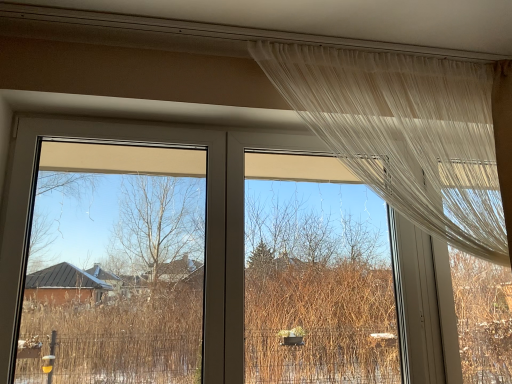
Question: From a real-world perspective, is transparent fabric at upper center, positioned as the 1th window screen in right-to-left order, positioned under sheer white curtain at upper right based on gravity?

Choices:
 (A) yes
 (B) no

Answer: (A)

Question: Are transparent fabric at upper center, placed as the second window screen when sorted from left to right, and sheer white curtain at upper right far apart?

Choices:
 (A) yes
 (B) no

Answer: (B)

Question: Is the surface of transparent fabric at upper center, positioned as the 1th window screen in right-to-left order, in direct contact with sheer white curtain at upper right?

Choices:
 (A) yes
 (B) no

Answer: (B)

Question: Does transparent fabric at upper center, placed as the second window screen when sorted from left to right, contain sheer white curtain at upper right?

Choices:
 (A) no
 (B) yes

Answer: (A)

Question: Is transparent fabric at upper center, placed as the second window screen when sorted from left to right, closer to camera compared to sheer white curtain at upper right?

Choices:
 (A) no
 (B) yes

Answer: (A)

Question: Considering the relative positions of transparent fabric at upper center, positioned as the 1th window screen in right-to-left order, and sheer white curtain at upper right in the image provided, is transparent fabric at upper center, positioned as the 1th window screen in right-to-left order, behind sheer white curtain at upper right?

Choices:
 (A) yes
 (B) no

Answer: (A)

Question: Considering the relative positions of transparent plastic window screen at left, the 2th window screen positioned from the right, and sheer white curtain at upper right in the image provided, is transparent plastic window screen at left, the 2th window screen positioned from the right, to the left of sheer white curtain at upper right from the viewer's perspective?

Choices:
 (A) no
 (B) yes

Answer: (B)

Question: Is transparent plastic window screen at left, which is the first window screen in left-to-right order, bigger than sheer white curtain at upper right?

Choices:
 (A) no
 (B) yes

Answer: (B)

Question: Considering the relative sizes of transparent plastic window screen at left, which is the first window screen in left-to-right order, and sheer white curtain at upper right in the image provided, is transparent plastic window screen at left, which is the first window screen in left-to-right order, smaller than sheer white curtain at upper right?

Choices:
 (A) yes
 (B) no

Answer: (B)

Question: Does transparent plastic window screen at left, which is the first window screen in left-to-right order, contain sheer white curtain at upper right?

Choices:
 (A) no
 (B) yes

Answer: (A)

Question: Is transparent plastic window screen at left, which is the first window screen in left-to-right order, positioned with its back to sheer white curtain at upper right?

Choices:
 (A) no
 (B) yes

Answer: (A)

Question: From the image's perspective, would you say transparent plastic window screen at left, the 2th window screen positioned from the right, is positioned over sheer white curtain at upper right?

Choices:
 (A) no
 (B) yes

Answer: (A)

Question: Can you confirm if sheer white curtain at upper right is bigger than transparent plastic window screen at left, which is the first window screen in left-to-right order?

Choices:
 (A) no
 (B) yes

Answer: (A)